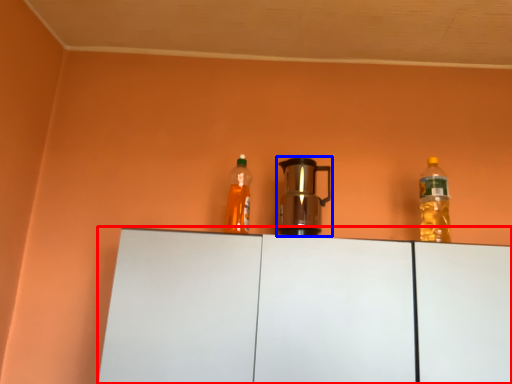
Question: Which of the following is the farthest to the observer, cabinetry (highlighted by a red box) or kitchen appliance (highlighted by a blue box)?

Choices:
 (A) cabinetry
 (B) kitchen appliance

Answer: (B)